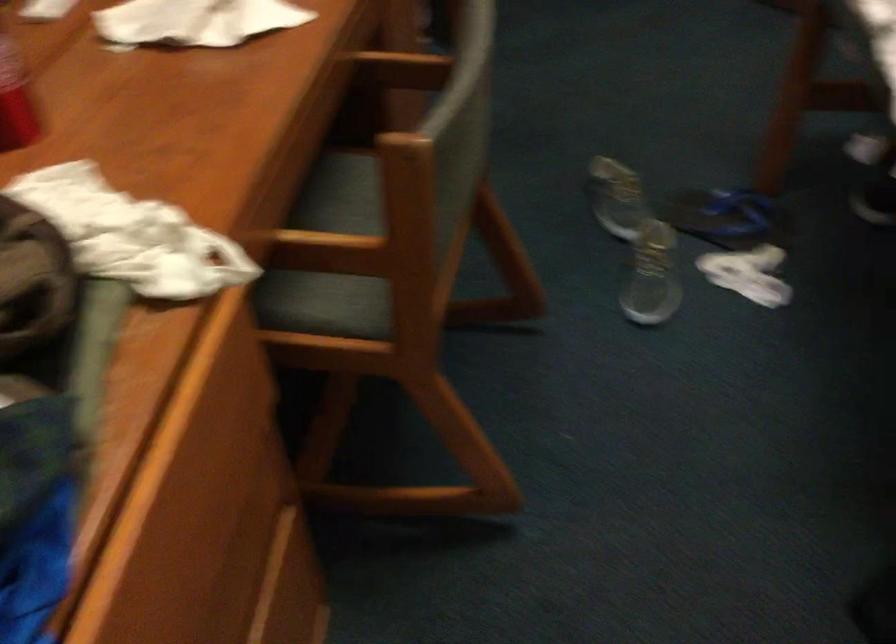
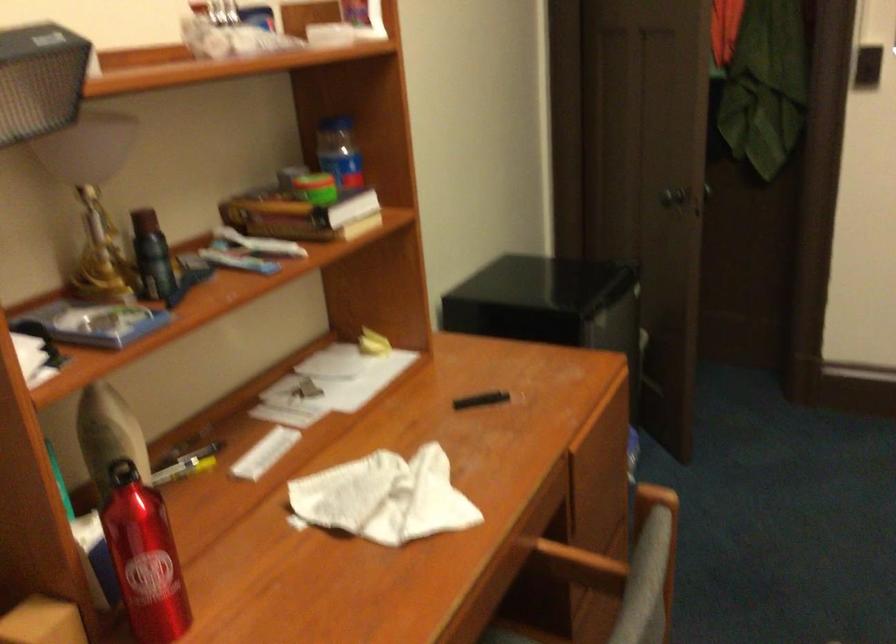
Question: The images are taken continuously from a first-person perspective. In which direction are you moving?

Choices:
 (A) Left
 (B) Right
 (C) Forward
 (D) Backward

Answer: (B)